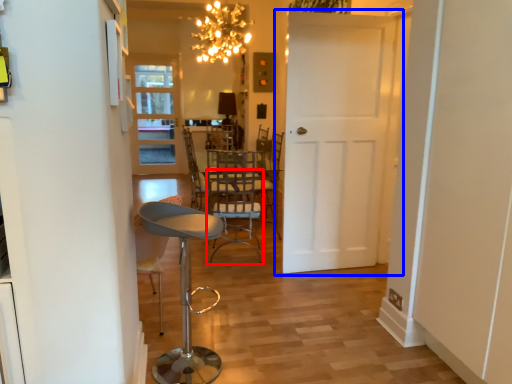
Question: Which object is closer to the camera taking this photo, armchair (highlighted by a red box) or door (highlighted by a blue box)?

Choices:
 (A) armchair
 (B) door

Answer: (B)